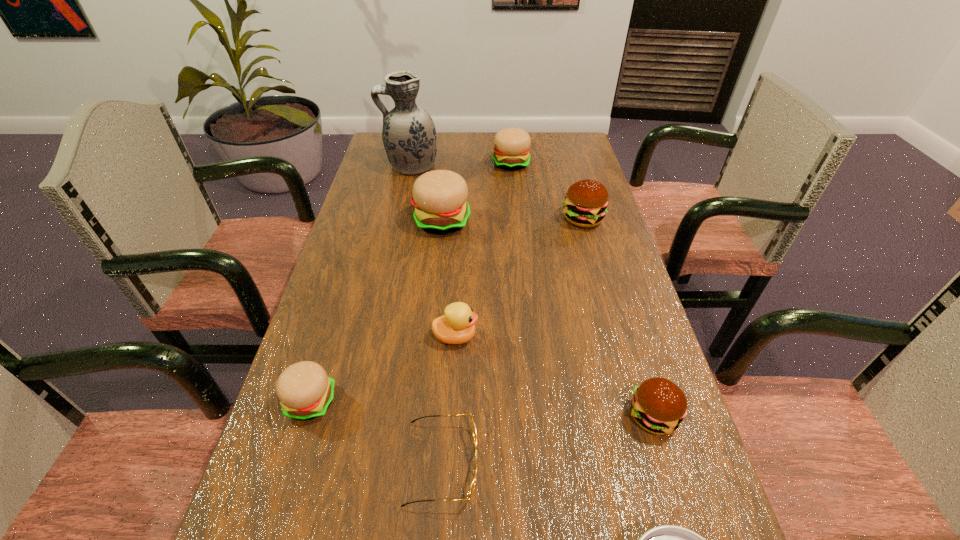
Where is `vacant space at the far right corner`? vacant space at the far right corner is located at coordinates (550, 147).

I want to click on unoccupied position between the farther brown hamburger and the yellow duckling, so click(519, 278).

Locate an element on the screen. The image size is (960, 540). vacant point located between the farther brown hamburger and the third hamburger from right to left is located at coordinates (547, 191).

Identify the location of free spot between the nearer brown hamburger and the farther brown hamburger. (618, 318).

Locate an element on the screen. object that stands as the third closest to the leftmost hamburger is located at coordinates (439, 197).

The height and width of the screenshot is (540, 960). Identify the location of object that stands as the closest to the smallest beige hamburger. (474, 432).

At what (x,y) coordinates should I click in order to perform the action: click on hamburger that is the third nearest to the second farthest beige hamburger. Please return your answer as a coordinate pair (x, y). The image size is (960, 540). Looking at the image, I should click on (305, 391).

Locate which hamburger ranks third in proximity to the second nearest beige hamburger. Please provide its 2D coordinates. Your answer should be formatted as a tuple, i.e. [(x, y)], where the tuple contains the x and y coordinates of a point satisfying the conditions above.

[(305, 391)]

This screenshot has height=540, width=960. What are the coordinates of `beige hamburger that stands as the third closest to the yellow duckling` in the screenshot? It's located at (512, 145).

This screenshot has height=540, width=960. In order to click on beige hamburger that stands as the second closest to the nearest object in this screenshot , I will do `click(439, 197)`.